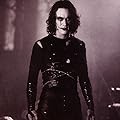
Where is `makeup`? This screenshot has width=120, height=120. makeup is located at coordinates (61, 18), (68, 18), (60, 23), (64, 28).